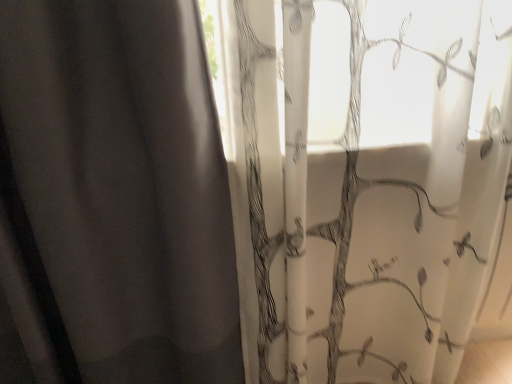
Locate an element on the screen. The image size is (512, 384). matte gray curtain at left is located at coordinates (113, 198).

Image resolution: width=512 pixels, height=384 pixels. What do you see at coordinates (113, 198) in the screenshot?
I see `matte gray curtain at left` at bounding box center [113, 198].

In order to click on matte gray curtain at left in this screenshot , I will do `click(113, 198)`.